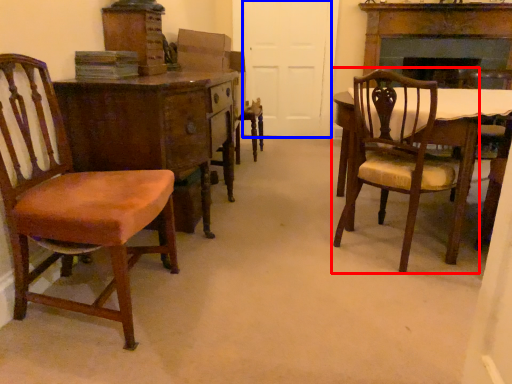
Question: Among these objects, which one is farthest to the camera, chair (highlighted by a red box) or door (highlighted by a blue box)?

Choices:
 (A) chair
 (B) door

Answer: (B)